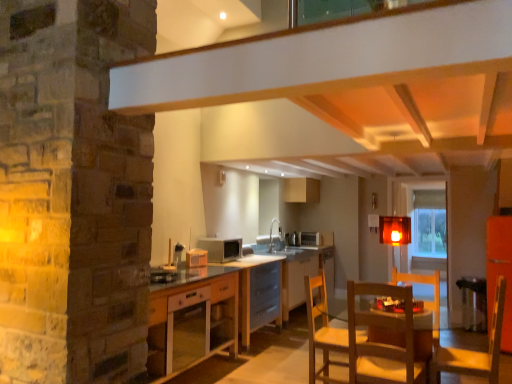
What are the coordinates of `transparent glass door at right` in the screenshot? It's located at (428, 229).

In the scene shown: Measure the distance between point (313, 297) and camera.

They are 11.25 feet apart.

What do you see at coordinates (301, 272) in the screenshot?
I see `wooden table at center, placed as the 1th table when sorted from back to front` at bounding box center [301, 272].

What is the approximate width of wooden table at center, placed as the 1th table when sorted from back to front?

67.94 centimeters.

Find the location of a particular element. This screenshot has width=512, height=384. white matte exhaust hood at upper center is located at coordinates (356, 78).

In order to face wooden table at center, which ranks as the second table in back-to-front order, should I rotate leftwards or rightwards?

Turn left by 1.801 degrees to look at wooden table at center, which ranks as the second table in back-to-front order.

The image size is (512, 384). What do you see at coordinates (258, 293) in the screenshot? I see `wooden table at center, which ranks as the second table in back-to-front order` at bounding box center [258, 293].

The image size is (512, 384). I want to click on metallic silver bar stool at lower right, so click(x=473, y=303).

Which is behind, wooden cabinet at lower center or translucent amber cube at center?

translucent amber cube at center.

Is wooden cabinet at lower center not close to translucent amber cube at center?

Absolutely, wooden cabinet at lower center is distant from translucent amber cube at center.

From the picture: Is translucent amber cube at center inside wooden cabinet at lower center?

Definitely not — translucent amber cube at center is not inside wooden cabinet at lower center.

Is wooden cabinet at lower center to the left of translucent amber cube at center from the viewer's perspective?

Yes, wooden cabinet at lower center is to the left of translucent amber cube at center.

Is transparent glass door at right positioned in front of wooden table at center, placed as the first table when sorted from front to back?

No, transparent glass door at right is further to the viewer.

Do you think transparent glass door at right is within wooden table at center, which ranks as the second table in back-to-front order, or outside of it?

transparent glass door at right cannot be found inside wooden table at center, which ranks as the second table in back-to-front order.

Who is smaller, transparent glass door at right or wooden table at center, which ranks as the second table in back-to-front order?

transparent glass door at right.

Between wooden table at center, which ranks as the second table in back-to-front order, and transparent glass door at right, which one has less height?

Standing shorter between the two is wooden table at center, which ranks as the second table in back-to-front order.

From a real-world perspective, starting from the transparent glass door at right, which table is the 2nd one below it? Please provide its 2D coordinates.

[(258, 293)]

Is wooden table at center, placed as the first table when sorted from front to back, positioned with its back to transparent glass door at right?

No, transparent glass door at right is not at the back of wooden table at center, placed as the first table when sorted from front to back.

From a real-world perspective, which object stands above the other?

From a 3D spatial view, wooden cabinet at lower center is above.

Can you confirm if wooden cabinet at lower center is bigger than wooden table at center, which ranks as the second table in back-to-front order?

Yes, wooden cabinet at lower center is bigger than wooden table at center, which ranks as the second table in back-to-front order.

Looking at their sizes, would you say wooden cabinet at lower center is wider or thinner than wooden table at center, which ranks as the second table in back-to-front order?

wooden cabinet at lower center is wider than wooden table at center, which ranks as the second table in back-to-front order.

Is white matte exhaust hood at upper center wider than metallic silver bar stool at lower right?

Indeed, white matte exhaust hood at upper center has a greater width compared to metallic silver bar stool at lower right.

Is white matte exhaust hood at upper center far from metallic silver bar stool at lower right?

Absolutely, white matte exhaust hood at upper center is distant from metallic silver bar stool at lower right.

Considering the relative positions of white matte exhaust hood at upper center and metallic silver bar stool at lower right in the image provided, is white matte exhaust hood at upper center in front of metallic silver bar stool at lower right?

That is True.

Is white matte exhaust hood at upper center situated inside metallic silver bar stool at lower right or outside?

white matte exhaust hood at upper center is spatially situated outside metallic silver bar stool at lower right.

From a real-world perspective, which is physically above, translucent amber cube at center or wooden table at center, which ranks as the second table in back-to-front order?

translucent amber cube at center.

Which table is the 1st one when counting from the back of the translucent amber cube at center? Please provide its 2D coordinates.

[(258, 293)]

Which of these two, translucent amber cube at center or wooden table at center, which ranks as the second table in back-to-front order, is smaller?

translucent amber cube at center.

Is transparent glass door at right bigger than wooden cabinet at lower center?

No, transparent glass door at right is not bigger than wooden cabinet at lower center.

From a real-world perspective, which is physically above, transparent glass door at right or wooden cabinet at lower center?

transparent glass door at right is physically above.

Are transparent glass door at right and wooden cabinet at lower center making contact?

There is a gap between transparent glass door at right and wooden cabinet at lower center.

At what (x,y) coordinates should I click in order to perform the action: click on glass door above the wooden cabinet at lower center (from a real-world perspective). Please return your answer as a coordinate pair (x, y). This screenshot has height=384, width=512. Looking at the image, I should click on (428, 229).

You are a GUI agent. You are given a task and a screenshot of the screen. Output one action in this format:
    pyautogui.click(x=<x>, y=<y>)
    Task: Click on the cabinetry below the translucent amber cube at center (from a real-world perspective)
    
    Given the screenshot: What is the action you would take?
    pyautogui.click(x=192, y=319)

The height and width of the screenshot is (384, 512). In order to click on table that is the 1st one when counting downward from the transparent glass door at right (from the image's perspective) in this screenshot , I will do `click(258, 293)`.

Based on their spatial positions, is matte white microwave at center or white matte exhaust hood at upper center closer to metallic silver bar stool at lower right?

white matte exhaust hood at upper center.

From the picture: Estimate the real-world distances between objects in this image. Which object is further from white matte exhaust hood at upper center, wooden cabinet at lower center or transparent glass door at right?

transparent glass door at right is positioned further to the anchor white matte exhaust hood at upper center.

Looking at the image, which one is located further to white matte exhaust hood at upper center, wooden table at center, placed as the first table when sorted from front to back, or translucent amber cube at center?

Among the two, wooden table at center, placed as the first table when sorted from front to back, is located further to white matte exhaust hood at upper center.

Estimate the real-world distances between objects in this image. Which object is further from light brown wooden chair at lower right, transparent glass door at right or wooden table at center, placed as the first table when sorted from front to back?

Based on the image, transparent glass door at right appears to be further to light brown wooden chair at lower right.

Based on their spatial positions, is metallic silver bar stool at lower right or wooden cabinet at lower center further from matte white microwave at center?

Based on the image, metallic silver bar stool at lower right appears to be further to matte white microwave at center.

When comparing their distances from wooden table at center, which ranks as the second table in front-to-back order, does metallic silver bar stool at lower right or matte white microwave at center seem further?

metallic silver bar stool at lower right is further to wooden table at center, which ranks as the second table in front-to-back order.

Looking at the image, which one is located closer to wooden table at center, which ranks as the second table in back-to-front order, matte white microwave at center or wooden cabinet at lower center?

Based on the image, matte white microwave at center appears to be nearer to wooden table at center, which ranks as the second table in back-to-front order.

When comparing their distances from wooden table at center, which ranks as the second table in front-to-back order, does matte white microwave at center or transparent glass door at right seem closer?

matte white microwave at center is positioned closer to the anchor wooden table at center, which ranks as the second table in front-to-back order.

This screenshot has width=512, height=384. Identify the location of bar stool positioned between white matte exhaust hood at upper center and transparent glass door at right from near to far. (473, 303).

Identify the location of cabinetry between white matte exhaust hood at upper center and transparent glass door at right in the front-back direction. (192, 319).

What are the coordinates of `appliance between wooden cabinet at lower center and translucent amber cube at center in the horizontal direction` in the screenshot? It's located at (221, 248).

What are the coordinates of `light fixture between light brown wooden chair at lower right and wooden table at center, placed as the 1th table when sorted from back to front, along the z-axis` in the screenshot? It's located at (395, 230).